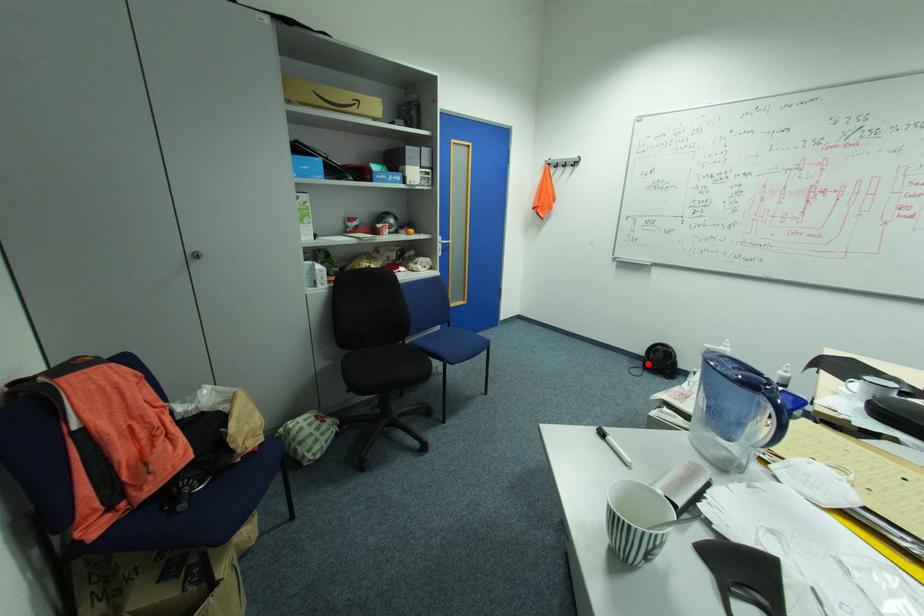
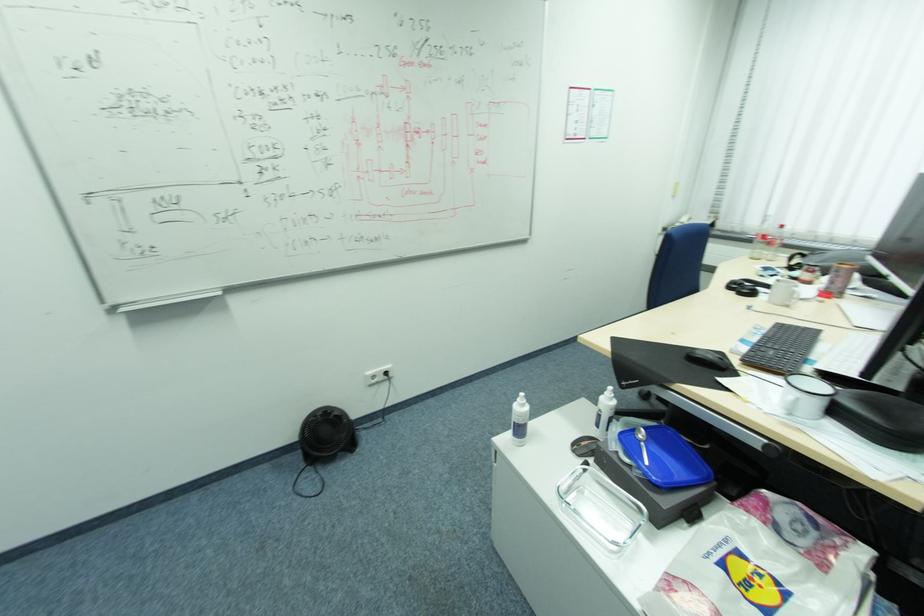
Question: I am providing you with two images of the same scene from different viewpoints. In image1, a red point is highlighted. Considering the same 3D point in image2, which of the following is correct?

Choices:
 (A) It is closer
 (B) It is farther

Answer: (B)